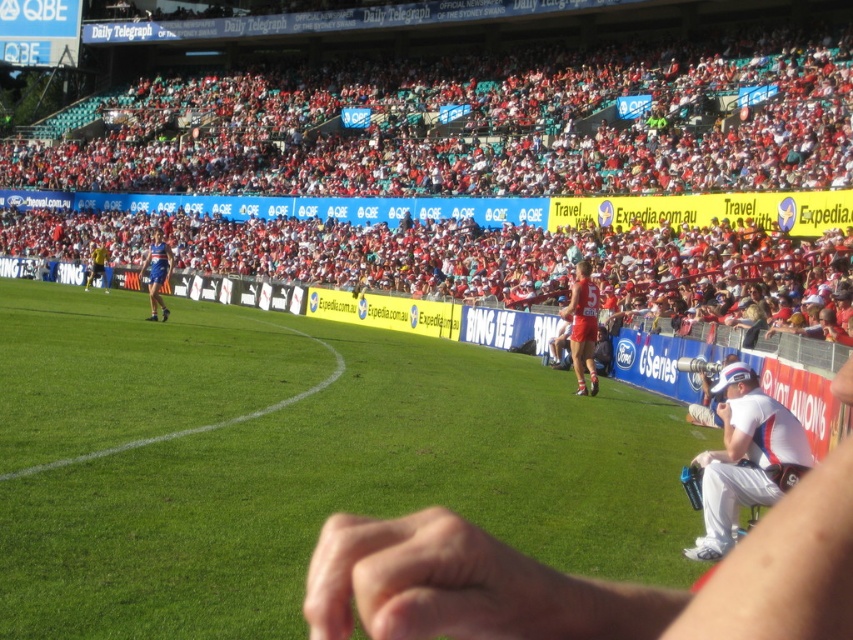
What object is located at the coordinate point (x=743, y=458) in the image?

The point (x=743, y=458) corresponds to the white fabric cap at right.

You are a photographer standing at the edge of the field. You want to take a photo of the green grass at center and the red fabric seats at upper center. Can you fit both in your camera frame if the maximum distance your camera can capture between two objects is 16 meters?

The green grass at center is 16.56 meters away from red fabric seats at upper center. Since 16.56 meters exceeds the camera frame limit of 16 meters, you cannot fit both in the frame.